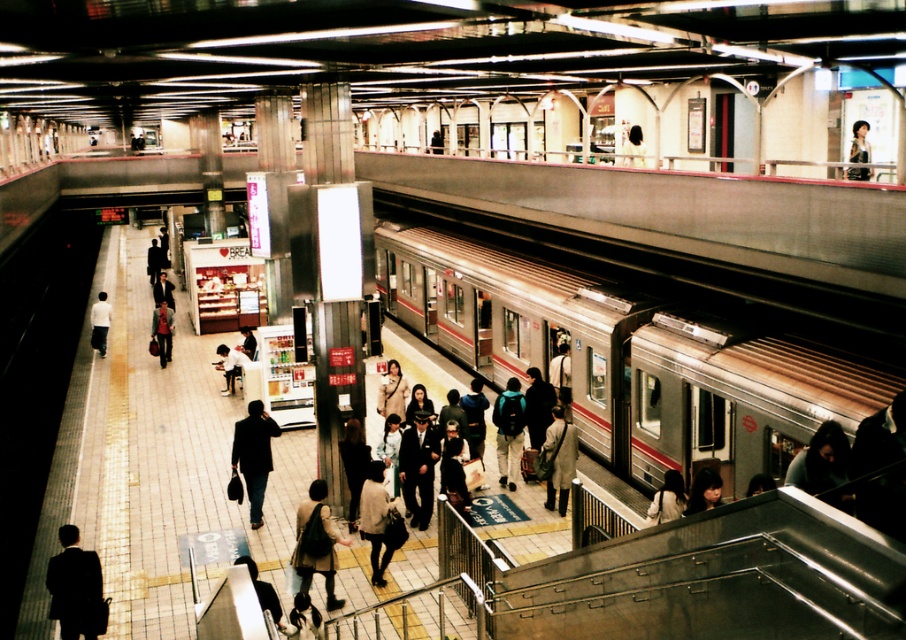
Question: Which object appears closest to the camera in this image?

Choices:
 (A) silhouette suit at lower left
 (B) silhouette suit at center
 (C) white matte jacket at left
 (D) light brown leather jacket at center

Answer: (A)

Question: Which point is closer to the camera?

Choices:
 (A) (170, 317)
 (B) (670, 480)
 (C) (396, 502)

Answer: (B)

Question: Which of the following is the closest to the observer?

Choices:
 (A) matte black suit at center
 (B) matte black jacket at lower center
 (C) light brown leather jacket at center

Answer: (B)

Question: Where is matte beige dress at center located in relation to light brown leather jacket at center in the image?

Choices:
 (A) below
 (B) above

Answer: (A)

Question: Is matte beige dress at center closer to camera compared to silhouette suit at center?

Choices:
 (A) no
 (B) yes

Answer: (B)

Question: Is silhouette suit at lower left wider than white fabric bag at center?

Choices:
 (A) yes
 (B) no

Answer: (A)